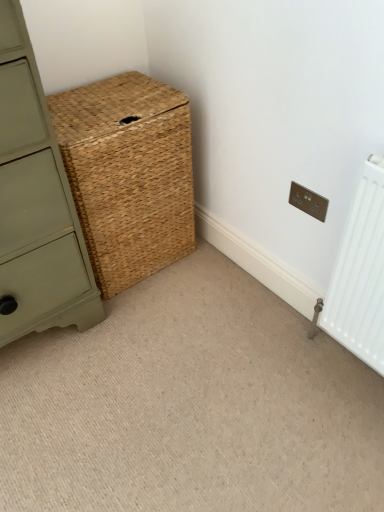
Question: Is point (38, 91) closer or farther from the camera than point (322, 201)?

Choices:
 (A) closer
 (B) farther

Answer: (A)

Question: Is matte green chest of drawers at center-left situated inside matte silver electric outlet at upper right or outside?

Choices:
 (A) outside
 (B) inside

Answer: (A)

Question: Considering the real-world distances, which object is farthest from the natural woven basket at center?

Choices:
 (A) matte green chest of drawers at center-left
 (B) natural woven basket at center
 (C) matte silver electric outlet at upper right

Answer: (C)

Question: Which of these objects is positioned closest to the matte silver electric outlet at upper right?

Choices:
 (A) natural woven basket at center
 (B) matte green chest of drawers at center-left
 (C) natural woven basket at center

Answer: (A)